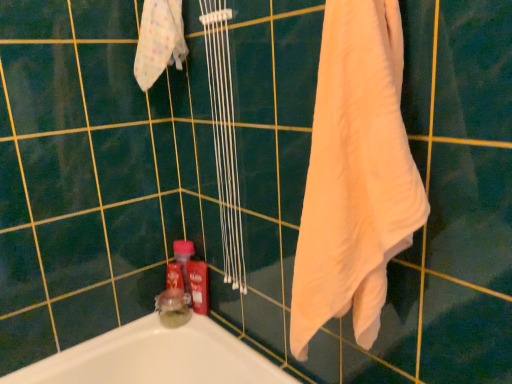
Describe the element at coordinates (198, 285) in the screenshot. I see `red glossy bottle at lower center` at that location.

In order to face white soft cloth at upper left, should I rotate leftwards or rightwards?

Turn left by 12.865 degrees to look at white soft cloth at upper left.

At what (x,y) coordinates should I click in order to perform the action: click on white soft towel at right. Please return your answer as a coordinate pair (x, y). Image resolution: width=512 pixels, height=384 pixels. Looking at the image, I should click on (355, 175).

The height and width of the screenshot is (384, 512). I want to click on red glossy bottle at lower center, so click(x=198, y=285).

Are white soft towel at right and translucent glass jar at lower left located far from each other?

white soft towel at right is near translucent glass jar at lower left, not far away.

From the image's perspective, is white soft towel at right below translucent glass jar at lower left?

Incorrect, from the image's perspective, white soft towel at right is higher than translucent glass jar at lower left.

Which of these two, white soft towel at right or translucent glass jar at lower left, is bigger?

Bigger between the two is white soft towel at right.

From the image's perspective, is white soft cloth at upper left located above or below red glossy bottle at lower center?

Clearly, from the image's perspective, white soft cloth at upper left is above red glossy bottle at lower center.

What's the angular difference between white soft cloth at upper left and red glossy bottle at lower center's facing directions?

They differ by 90 degrees in their facing directions.

Which point is more forward, (139, 48) or (197, 304)?

The point (139, 48) is closer.

Does white soft cloth at upper left have a larger size compared to red glossy bottle at lower center?

Correct, white soft cloth at upper left is larger in size than red glossy bottle at lower center.

Does translucent glass jar at lower left have a larger size compared to white soft cloth at upper left?

Actually, translucent glass jar at lower left might be smaller than white soft cloth at upper left.

In terms of height, does translucent glass jar at lower left look taller or shorter compared to white soft cloth at upper left?

translucent glass jar at lower left is shorter than white soft cloth at upper left.

Which point is more distant from viewer, (190,298) or (152,23)?

The point (190,298) is behind.

Where is `bath towel in front of the translucent glass jar at lower left`? The width and height of the screenshot is (512, 384). bath towel in front of the translucent glass jar at lower left is located at coordinates (159, 41).

Based on the photo, what's the angular difference between white soft cloth at upper left and white soft towel at right's facing directions?

2.03 degrees.

I want to click on bath towel that appears above the white soft towel at right (from the image's perspective), so click(x=159, y=41).

Is point (152, 6) more distant than point (338, 89)?

Yes, it is.

Considering the relative sizes of white soft cloth at upper left and white soft towel at right in the image provided, is white soft cloth at upper left smaller than white soft towel at right?

Indeed, white soft cloth at upper left has a smaller size compared to white soft towel at right.

Which object is positioned more to the left, white soft towel at right or white soft cloth at upper left?

Positioned to the left is white soft cloth at upper left.

Could you tell me if white soft towel at right is facing white soft cloth at upper left?

No, white soft towel at right is not aimed at white soft cloth at upper left.

Between white soft towel at right and white soft cloth at upper left, which one has larger size?

Bigger between the two is white soft towel at right.

Based on the photo, is white soft towel at right inside or outside of white soft cloth at upper left?

white soft towel at right is outside white soft cloth at upper left.

How many degrees apart are the facing directions of white soft towel at right and red glossy bottle at lower center?

The angular difference between white soft towel at right and red glossy bottle at lower center is 92 degrees.

Which object is closer to the camera, white soft towel at right or red glossy bottle at lower center?

white soft towel at right.

From the image's perspective, is white soft towel at right on top of red glossy bottle at lower center?

Yes, from the image's perspective, white soft towel at right is over red glossy bottle at lower center.

From a real-world perspective, is white soft towel at right positioned over red glossy bottle at lower center based on gravity?

Yes, from a real-world perspective, white soft towel at right is above red glossy bottle at lower center.

From a real-world perspective, which is physically below, red glossy bottle at lower center or white soft cloth at upper left?

From a 3D spatial view, red glossy bottle at lower center is below.

Considering the relative positions of red glossy bottle at lower center and white soft cloth at upper left in the image provided, is red glossy bottle at lower center to the left of white soft cloth at upper left from the viewer's perspective?

No.

Who is more distant, red glossy bottle at lower center or white soft cloth at upper left?

red glossy bottle at lower center is behind.

At what (x,y) coordinates should I click in order to perform the action: click on toiletry that is below the white soft towel at right (from the image's perspective). Please return your answer as a coordinate pair (x, y). This screenshot has width=512, height=384. Looking at the image, I should click on (173, 307).

Identify the location of cleaning product behind the white soft cloth at upper left. (198, 285).

Considering their positions, is translucent glass jar at lower left positioned closer to red glossy bottle at lower center than white soft towel at right?

The object closer to red glossy bottle at lower center is translucent glass jar at lower left.

Considering their positions, is white soft cloth at upper left positioned closer to translucent glass jar at lower left than white soft towel at right?

The object closer to translucent glass jar at lower left is white soft cloth at upper left.

From the image, which object appears to be farther from red glossy bottle at lower center, white soft towel at right or translucent glass jar at lower left?

white soft towel at right is further to red glossy bottle at lower center.

When comparing their distances from red glossy bottle at lower center, does white soft cloth at upper left or white soft towel at right seem further?

Among the two, white soft towel at right is located further to red glossy bottle at lower center.

Based on their spatial positions, is red glossy bottle at lower center or translucent glass jar at lower left closer to white soft towel at right?

red glossy bottle at lower center.

When comparing their distances from white soft towel at right, does translucent glass jar at lower left or white soft cloth at upper left seem further?

translucent glass jar at lower left is positioned further to the anchor white soft towel at right.

When comparing their distances from translucent glass jar at lower left, does white soft cloth at upper left or red glossy bottle at lower center seem closer?

red glossy bottle at lower center lies closer to translucent glass jar at lower left than the other object.

Considering their positions, is white soft cloth at upper left positioned closer to red glossy bottle at lower center than translucent glass jar at lower left?

Based on the image, translucent glass jar at lower left appears to be nearer to red glossy bottle at lower center.

What are the coordinates of `bath towel between white soft towel at right and red glossy bottle at lower center from front to back` in the screenshot? It's located at (159, 41).

At what (x,y) coordinates should I click in order to perform the action: click on bath towel between white soft towel at right and translucent glass jar at lower left in the front-back direction. Please return your answer as a coordinate pair (x, y). The image size is (512, 384). Looking at the image, I should click on (159, 41).

Where is `toiletry positioned between white soft towel at right and red glossy bottle at lower center from near to far`? toiletry positioned between white soft towel at right and red glossy bottle at lower center from near to far is located at coordinates (173, 307).

Where is `cleaning product that lies between white soft cloth at upper left and translucent glass jar at lower left from top to bottom`? cleaning product that lies between white soft cloth at upper left and translucent glass jar at lower left from top to bottom is located at coordinates (198, 285).